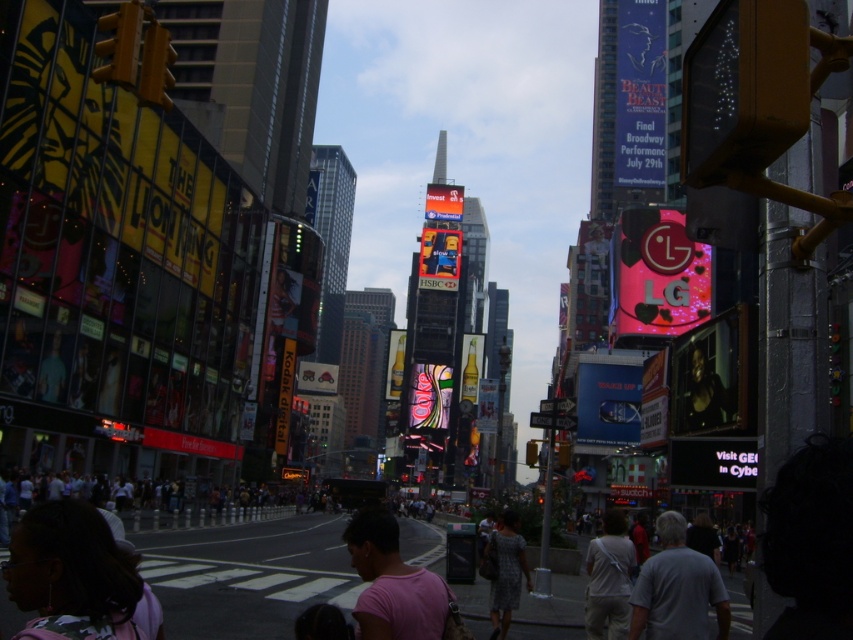
Can you confirm if dark pink fabric at lower left is bigger than gray cotton shirt at center?

Indeed, dark pink fabric at lower left has a larger size compared to gray cotton shirt at center.

Locate an element on the screen. The height and width of the screenshot is (640, 853). dark pink fabric at lower left is located at coordinates (70, 573).

Can you confirm if printed fabric dress at center is thinner than dark gray shirt at center?

Yes, printed fabric dress at center is thinner than dark gray shirt at center.

Does printed fabric dress at center appear on the left side of dark gray shirt at center?

Indeed, printed fabric dress at center is positioned on the left side of dark gray shirt at center.

Where is `printed fabric dress at center`? Image resolution: width=853 pixels, height=640 pixels. printed fabric dress at center is located at coordinates (506, 572).

Does dark pink fabric at lower left have a smaller size compared to printed fabric dress at center?

Yes, dark pink fabric at lower left is smaller than printed fabric dress at center.

Between point (67, 500) and point (491, 621), which one is positioned in front?

Positioned in front is point (67, 500).

The height and width of the screenshot is (640, 853). What do you see at coordinates (70, 573) in the screenshot?
I see `dark pink fabric at lower left` at bounding box center [70, 573].

Where is `dark pink fabric at lower left`? dark pink fabric at lower left is located at coordinates (70, 573).